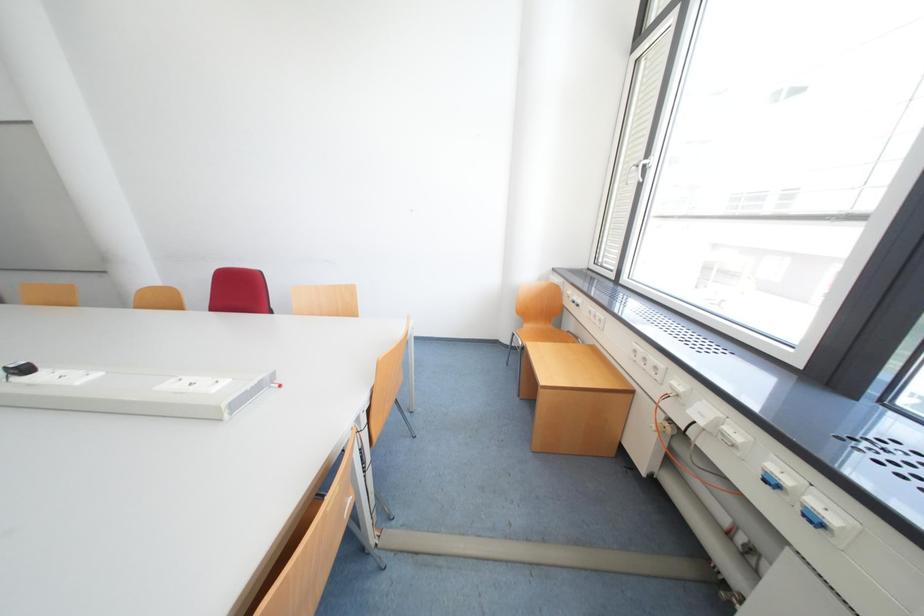
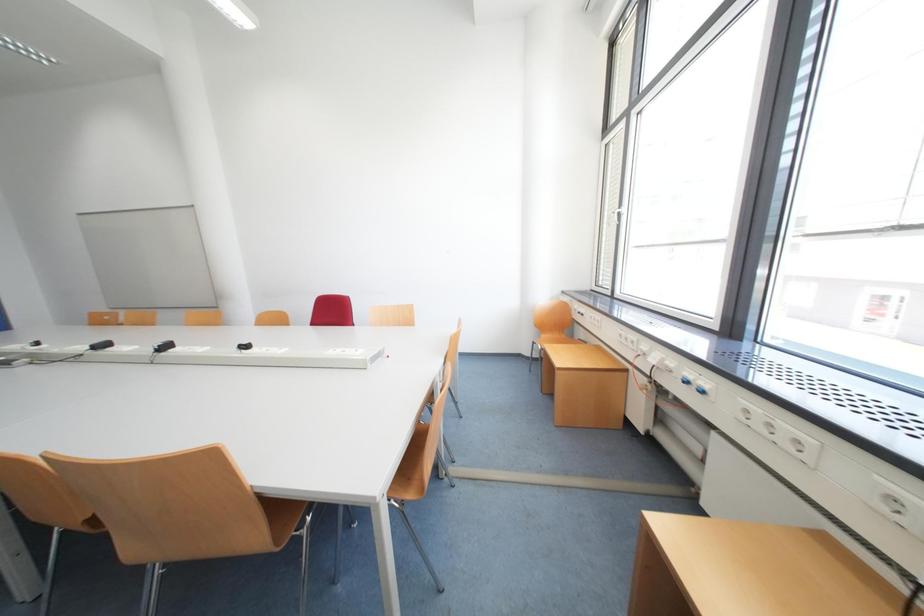
Question: What movement of the cameraman would produce the second image?

Choices:
 (A) Left
 (B) Right
 (C) Forward
 (D) Backward

Answer: (D)